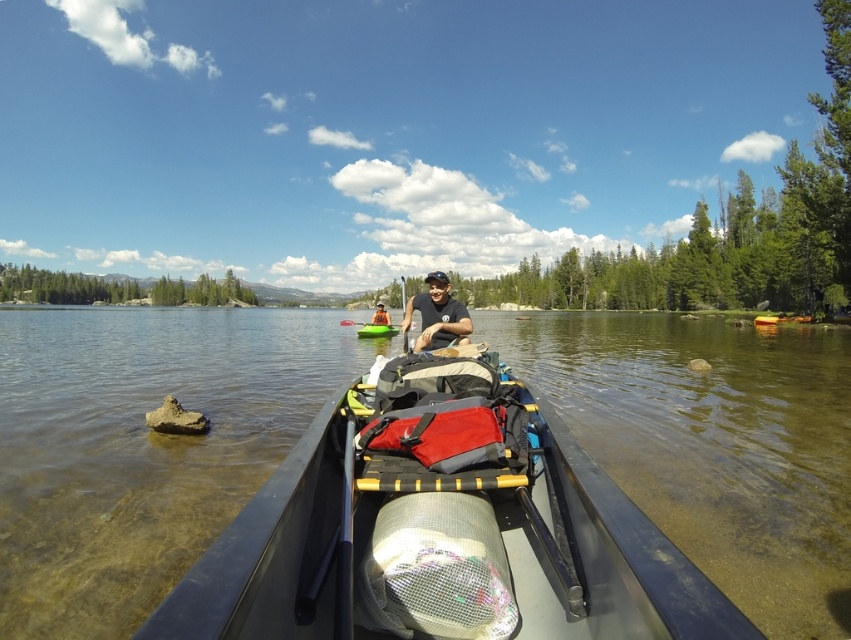
From the picture: You are in a kayak and need to reach the green plastic paddle at center to paddle. The black plastic canoe at center is blocking your path. Can you safely move around it to get to the paddle?

The distance between the black plastic canoe at center and green plastic paddle at center is 6.19 meters. Since the canoe is blocking your path, you would need to maneuver around it. However, the distance provided does not indicate the space available to navigate around the canoe. Without knowing the size of the canoe or the width of the waterway, it is impossible to determine if there is enough space to safely move around it. Therefore, proceed with caution and assess the situation visually before making a

You are in a kayak and want to pass between the black plastic canoe at center and the matte black kayak at center. Based on their positions, which direction should you steer to avoid collision?

The black plastic canoe at center is closer to the viewer than the matte black kayak at center. To avoid collision, steer towards the matte black kayak at center since it is farther away, allowing space to pass safely between them.